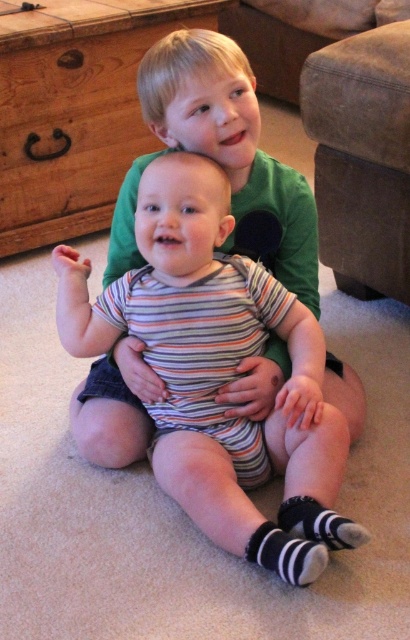
Question: Observing the image, what is the correct spatial positioning of brushed wood drawer at left in reference to black striped sock at lower center?

Choices:
 (A) above
 (B) below

Answer: (A)

Question: In this image, where is black striped sock at lower center located relative to striped fabric sock at lower center?

Choices:
 (A) above
 (B) below

Answer: (B)

Question: Which object is positioned closest to the striped fabric baby at center?

Choices:
 (A) striped fabric sock at lower center
 (B) black striped sock at lower center

Answer: (A)

Question: Which point appears farthest from the camera in this image?

Choices:
 (A) (20, 131)
 (B) (384, 188)
 (C) (339, 433)

Answer: (A)

Question: Can you confirm if brushed wood drawer at left is positioned to the right of black striped sock at lower center?

Choices:
 (A) yes
 (B) no

Answer: (B)

Question: Which object is positioned closest to the striped fabric sock at lower center?

Choices:
 (A) striped fabric baby at center
 (B) suede-like beige armchair at upper right
 (C) brushed wood drawer at left

Answer: (A)